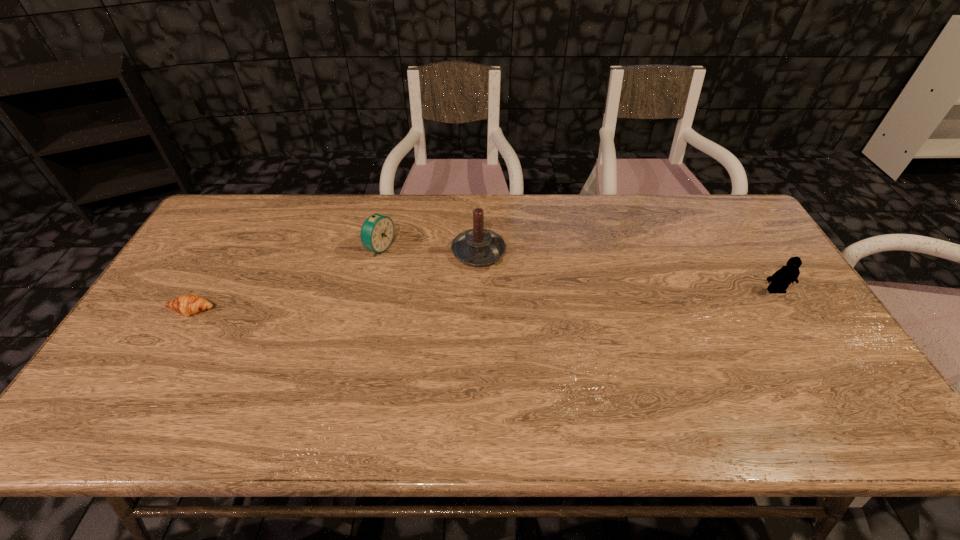
The height and width of the screenshot is (540, 960). Identify the location of vacant space in between the third farthest object and the alarm clock. (578, 269).

Where is `vacant region between the third object from right to left and the pastry`? vacant region between the third object from right to left and the pastry is located at coordinates coord(286,279).

You are a GUI agent. You are given a task and a screenshot of the screen. Output one action in this format:
    pyautogui.click(x=<x>, y=<y>)
    Task: Click on the free area in between the third farthest object and the pastry
    
    Given the screenshot: What is the action you would take?
    484,300

At what (x,y) coordinates should I click in order to perform the action: click on empty space between the leftmost object and the rightmost object. Please return your answer as a coordinate pair (x, y). Looking at the image, I should click on (484, 300).

You are a GUI agent. You are given a task and a screenshot of the screen. Output one action in this format:
    pyautogui.click(x=<x>, y=<y>)
    Task: Click on the empty space between the alarm clock and the candle
    This screenshot has width=960, height=540.
    Given the screenshot: What is the action you would take?
    pyautogui.click(x=429, y=250)

Where is `object that can be found as the third closest to the alarm clock`? This screenshot has height=540, width=960. object that can be found as the third closest to the alarm clock is located at coordinates (780, 280).

Select which object appears as the third closest to the third object from right to left. Please provide its 2D coordinates. Your answer should be formatted as a tuple, i.e. [(x, y)], where the tuple contains the x and y coordinates of a point satisfying the conditions above.

[(780, 280)]

The width and height of the screenshot is (960, 540). In order to click on free location that satisfies the following two spatial constraints: 1. on the front side of the second object from left to right; 2. on the left side of the tallest object in this screenshot , I will do `click(378, 252)`.

Locate an element on the screen. free space that satisfies the following two spatial constraints: 1. on the front side of the tallest object; 2. on the right side of the alarm clock is located at coordinates (378, 252).